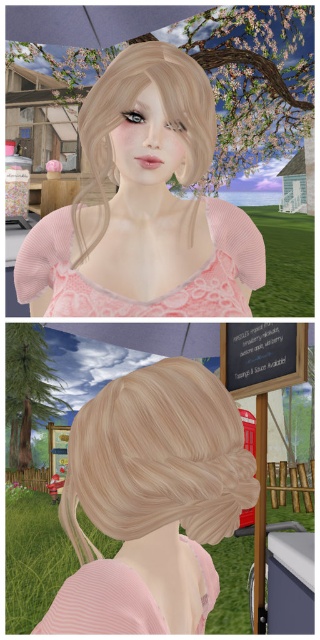
Identify the location of matte pink sweater at center. (144, 204).

Is matte pink sweater at center wider than blonde textured hair at center?

Yes.

Who is more distant from viewer, [157,150] or [74,525]?

The point [157,150] is more distant.

The width and height of the screenshot is (320, 640). What are the coordinates of `matte pink sweater at center` in the screenshot? It's located at (144, 204).

Does blonde wood hair bun at upper center appear on the left side of blonde textured hair at center?

Incorrect, blonde wood hair bun at upper center is not on the left side of blonde textured hair at center.

Is point (224, 445) positioned after point (72, 506)?

No, (224, 445) is in front of (72, 506).

Find the location of a particular element. blonde wood hair bun at upper center is located at coordinates (158, 458).

Does blonde wood hair bun at upper center come in front of blondehair at upper center?

Yes.

Which is in front, point (127, 490) or point (200, 83)?

Point (127, 490) is more forward.

Identify the location of blonde wood hair bun at upper center. This screenshot has width=320, height=640. (158, 458).